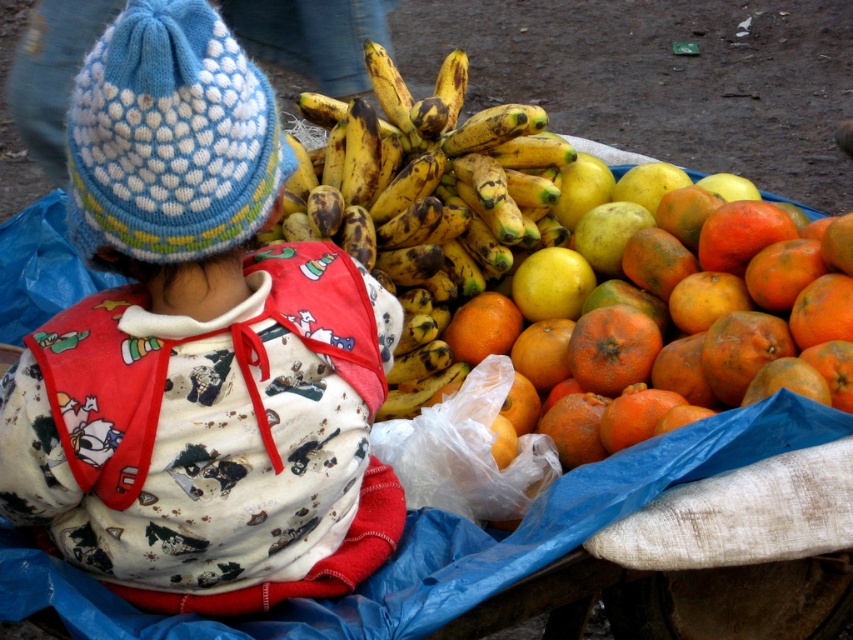
Can you confirm if knitted wool hat at upper left is wider than ripe orange at center?

Yes, knitted wool hat at upper left is wider than ripe orange at center.

Find the location of a particular element. The width and height of the screenshot is (853, 640). knitted wool hat at upper left is located at coordinates (199, 348).

Is ripe orange at center smaller than orange matte at center?

Actually, ripe orange at center might be larger than orange matte at center.

Does ripe orange at center have a greater width compared to orange matte at center?

Correct, the width of ripe orange at center exceeds that of orange matte at center.

Who is more forward, (581, 372) or (463, 342)?

Point (581, 372)

The width and height of the screenshot is (853, 640). Identify the location of ripe orange at center. (612, 348).

Which of these two, knitted wool hat at upper left or orange matte citrus at right, stands shorter?

orange matte citrus at right

Does knitted wool hat at upper left have a lesser height compared to orange matte citrus at right?

Incorrect, knitted wool hat at upper left's height does not fall short of orange matte citrus at right's.

At what (x,y) coordinates should I click in order to perform the action: click on knitted wool hat at upper left. Please return your answer as a coordinate pair (x, y). The width and height of the screenshot is (853, 640). Looking at the image, I should click on (199, 348).

The image size is (853, 640). I want to click on knitted wool hat at upper left, so click(199, 348).